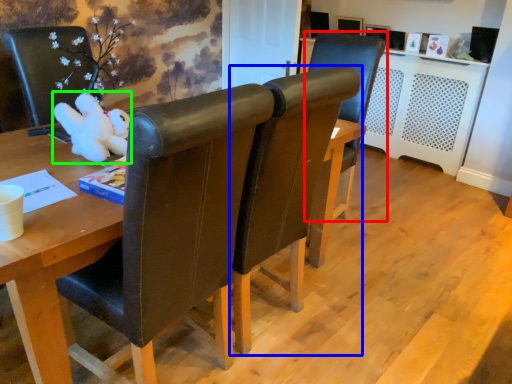
Question: Considering the real-world distances, which object is closest to chair (highlighted by a red box)? chair (highlighted by a blue box) or toy (highlighted by a green box).

Choices:
 (A) chair
 (B) toy

Answer: (A)